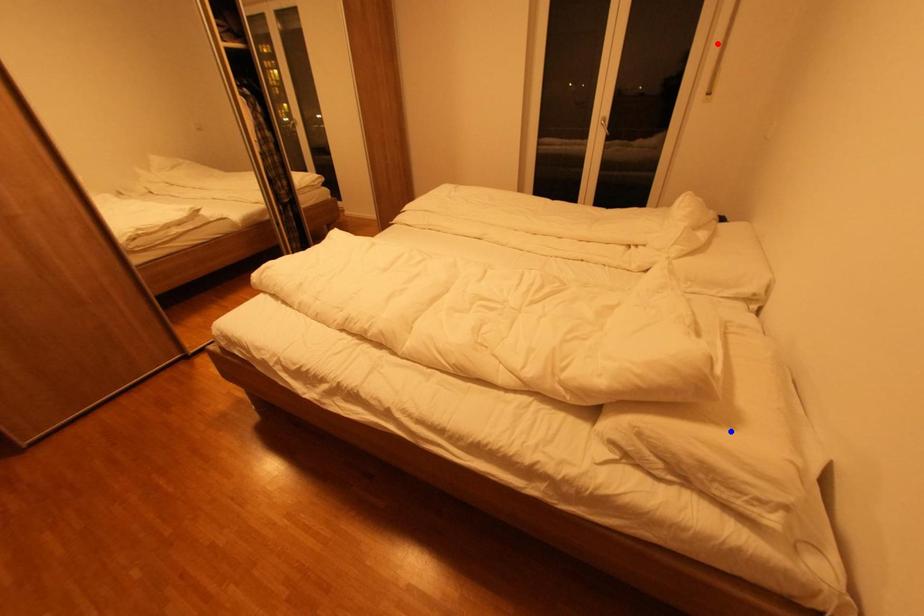
Question: In the image, two points are highlighted. Which point is nearer to the camera? Reply with the corresponding letter.

Choices:
 (A) blue point
 (B) red point

Answer: (A)